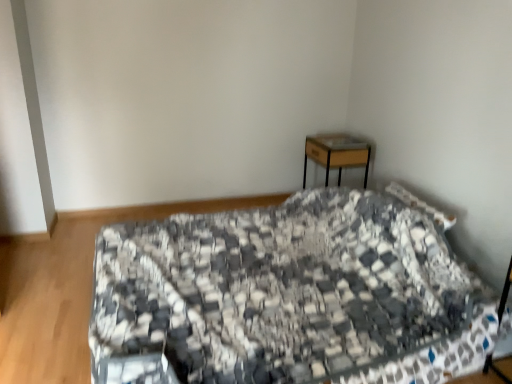
Question: From a real-world perspective, is wooden desk at upper right over black-and-white quilted bed at center?

Choices:
 (A) yes
 (B) no

Answer: (A)

Question: Can you confirm if wooden desk at upper right is positioned to the left of black-and-white quilted bed at center?

Choices:
 (A) no
 (B) yes

Answer: (A)

Question: Could you tell me if wooden desk at upper right is turned towards black-and-white quilted bed at center?

Choices:
 (A) yes
 (B) no

Answer: (B)

Question: From a real-world perspective, is wooden desk at upper right positioned under black-and-white quilted bed at center based on gravity?

Choices:
 (A) no
 (B) yes

Answer: (A)

Question: Can you confirm if wooden desk at upper right is taller than black-and-white quilted bed at center?

Choices:
 (A) no
 (B) yes

Answer: (A)

Question: Does wooden desk at upper right appear on the right side of black-and-white quilted bed at center?

Choices:
 (A) no
 (B) yes

Answer: (B)

Question: Is black-and-white quilted bed at center shorter than wooden desk at upper right?

Choices:
 (A) yes
 (B) no

Answer: (B)

Question: Is black-and-white quilted bed at center placed right next to wooden desk at upper right?

Choices:
 (A) yes
 (B) no

Answer: (B)

Question: From a real-world perspective, is black-and-white quilted bed at center positioned under wooden desk at upper right based on gravity?

Choices:
 (A) no
 (B) yes

Answer: (B)

Question: Is black-and-white quilted bed at center at the right side of wooden desk at upper right?

Choices:
 (A) no
 (B) yes

Answer: (A)

Question: Is black-and-white quilted bed at center thinner than wooden desk at upper right?

Choices:
 (A) no
 (B) yes

Answer: (A)

Question: From the image's perspective, is black-and-white quilted bed at center above wooden desk at upper right?

Choices:
 (A) no
 (B) yes

Answer: (A)

Question: In terms of width, does black-and-white quilted bed at center look wider or thinner when compared to wooden desk at upper right?

Choices:
 (A) thin
 (B) wide

Answer: (B)